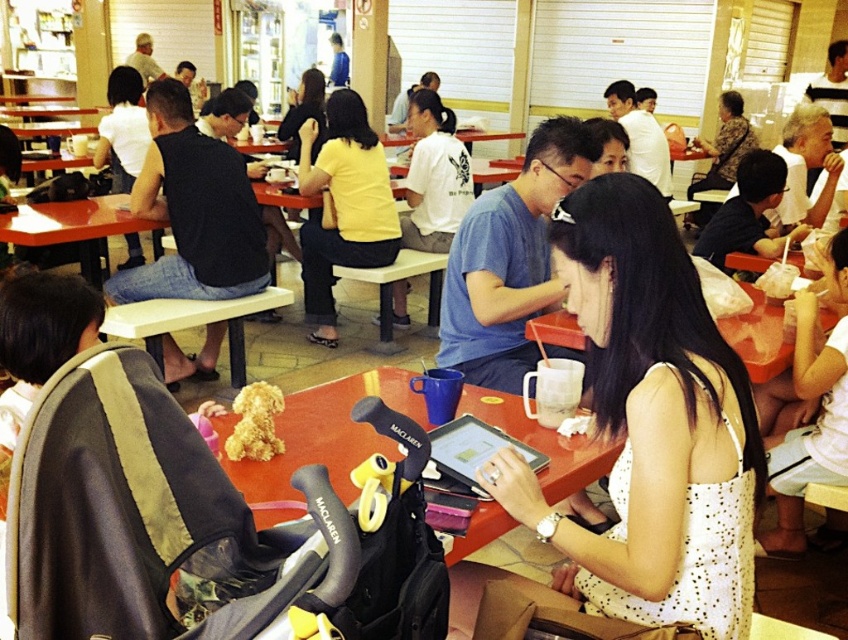
Question: Which of the following is the closest to the observer?

Choices:
 (A) (402, 620)
 (B) (742, 200)
 (C) (813, 364)

Answer: (A)

Question: Can you confirm if white dotted dress at center is bigger than matte black shirt at upper right?

Choices:
 (A) no
 (B) yes

Answer: (A)

Question: Which of the following is the farthest from the observer?

Choices:
 (A) blue cotton shirt at center
 (B) black sleeveless shirt at left

Answer: (B)

Question: Based on their relative distances, which object is nearer to the white matte shirt at center?

Choices:
 (A) white plastic table at lower center
 (B) matte black shirt at upper right
 (C) yellow matte shirt at center

Answer: (C)

Question: Does black leather baby carriage at lower left have a larger size compared to white shirt at upper center?

Choices:
 (A) yes
 (B) no

Answer: (B)

Question: Is white plastic table at lower center above white shirt at upper center?

Choices:
 (A) no
 (B) yes

Answer: (A)